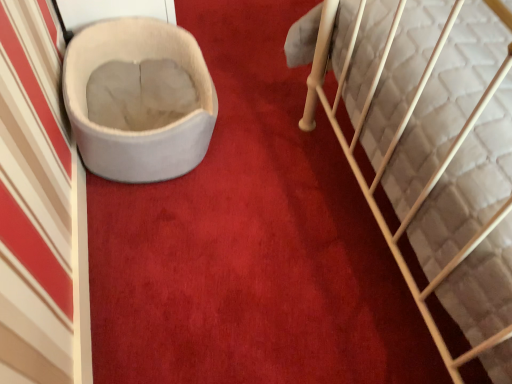
The image size is (512, 384). Find the location of `free space in front of white plush cat bed at left`. free space in front of white plush cat bed at left is located at coordinates (173, 241).